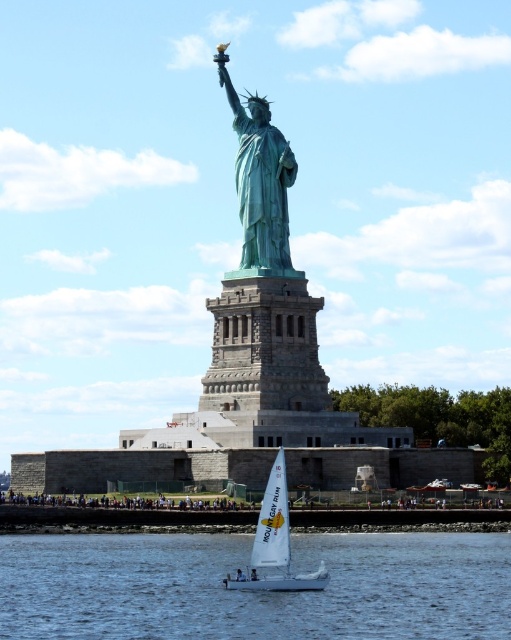
You are standing on the deck of the white sailboat at lower center and want to take a photo of the green patina statue at center. Given that your camera has a maximum zoom of 10x, can you fit the entire statue into the frame without moving the boat?

The green patina statue at center is smaller than the white sailboat at lower center. Since the statue is smaller, it should fit within the camera frame without needing to zoom beyond 10x, provided the distance allows for proper framing.

Based on the photo, you are a tourist standing at the base of the Statue of Liberty and want to take a photo of the clear blue water at lower center. Where should you position yourself to capture the water in the frame?

To capture the clear blue water at lower center, position yourself so that the water is centered at the coordinates approximately 0.927 along the horizontal axis and 0.501 along the vertical axis of your camera frame.